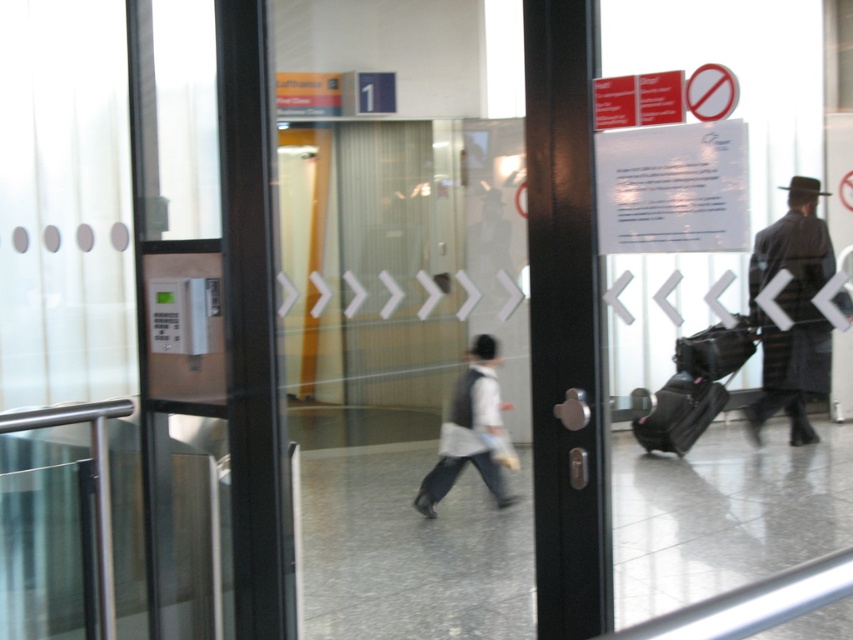
Between point (762, 337) and point (677, 445), which one is positioned behind?

Positioned behind is point (677, 445).

Is point (750, 410) farther from viewer compared to point (653, 419)?

That is False.

Find the location of a particular element. This screenshot has height=640, width=853. dark wool coat at right is located at coordinates (792, 312).

Can you confirm if dark wool coat at right is positioned to the left of black fabric suitcase at lower right?

No, dark wool coat at right is not to the left of black fabric suitcase at lower right.

Which is behind, point (787, 236) or point (730, 328)?

The point (730, 328) is more distant.

What do you see at coordinates (792, 312) in the screenshot? The width and height of the screenshot is (853, 640). I see `dark wool coat at right` at bounding box center [792, 312].

Locate an element on the screen. The width and height of the screenshot is (853, 640). dark wool coat at right is located at coordinates (792, 312).

Can you confirm if white fabric shirt at center is bigger than black fabric suitcase at lower right?

Indeed, white fabric shirt at center has a larger size compared to black fabric suitcase at lower right.

Can you confirm if white fabric shirt at center is smaller than black fabric suitcase at lower right?

No.

Image resolution: width=853 pixels, height=640 pixels. What do you see at coordinates (469, 432) in the screenshot? I see `white fabric shirt at center` at bounding box center [469, 432].

Locate an element on the screen. The image size is (853, 640). white fabric shirt at center is located at coordinates (469, 432).